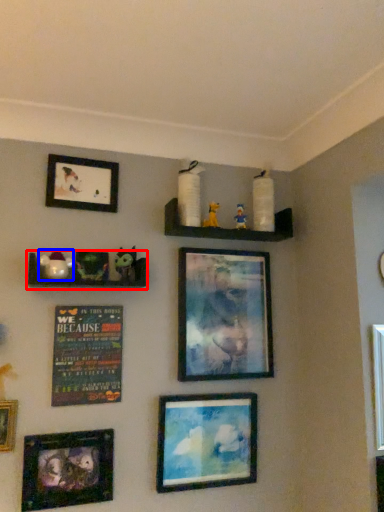
Question: Which point is further to the camera, shelf (highlighted by a red box) or toy (highlighted by a blue box)?

Choices:
 (A) shelf
 (B) toy

Answer: (B)